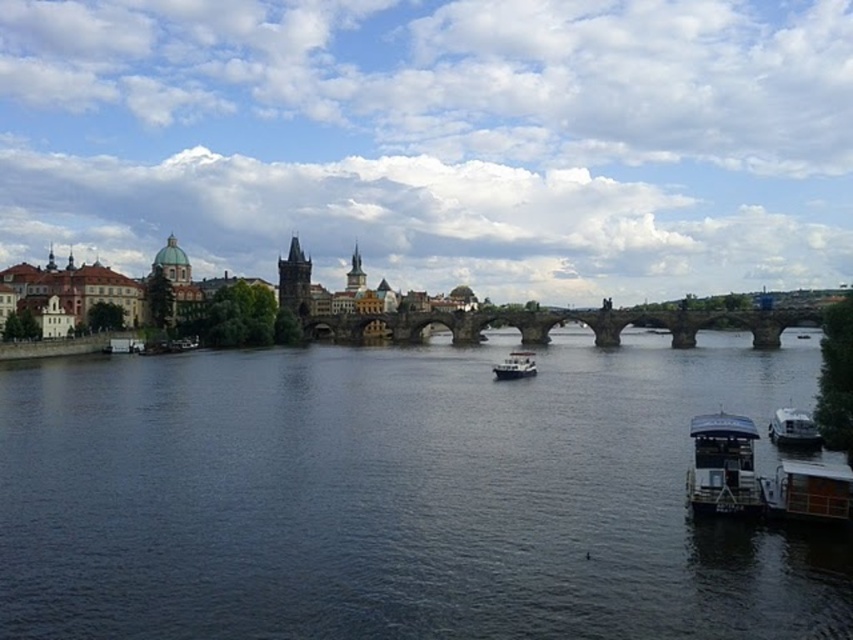
What do you see at coordinates (397, 496) in the screenshot?
I see `dark blue water at center` at bounding box center [397, 496].

The width and height of the screenshot is (853, 640). What are the coordinates of `dark blue water at center` in the screenshot? It's located at (397, 496).

I want to click on dark blue water at center, so click(x=397, y=496).

How much distance is there between metallic gray boat at lower right and white plastic boat at lower right?

metallic gray boat at lower right and white plastic boat at lower right are 11.93 feet apart from each other.

Can you confirm if metallic gray boat at lower right is positioned above white plastic boat at lower right?

Yes, metallic gray boat at lower right is above white plastic boat at lower right.

Locate an element on the screen. The height and width of the screenshot is (640, 853). metallic gray boat at lower right is located at coordinates (722, 467).

Does white plastic boat at lower right appear on the left side of white glossy boat at center?

No, white plastic boat at lower right is not to the left of white glossy boat at center.

Who is more distant from viewer, (828, 508) or (531, 365)?

The point (531, 365) is behind.

Does point (833, 497) lie behind point (498, 380)?

No, (833, 497) is closer to viewer.

Where is `white plastic boat at lower right`? white plastic boat at lower right is located at coordinates (808, 492).